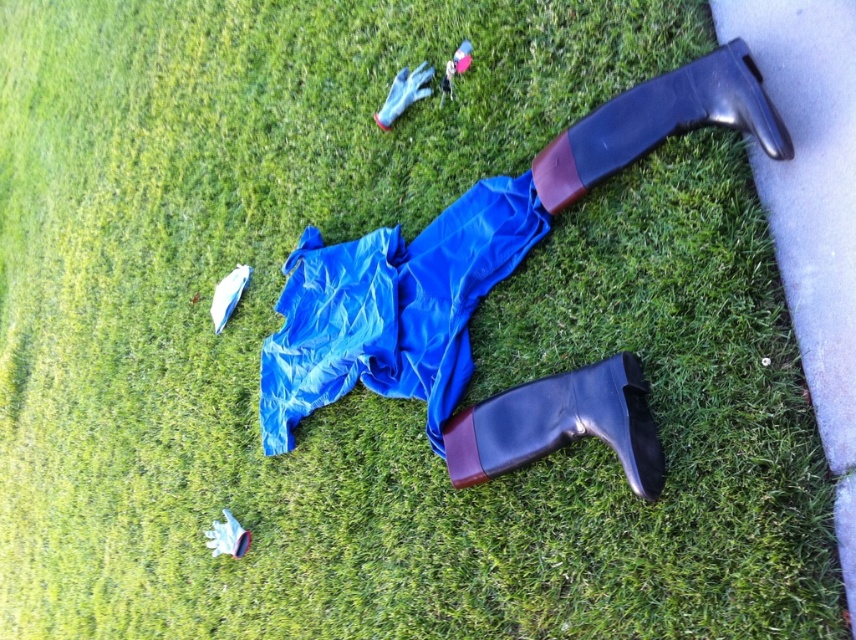
Question: Which point is farther to the camera?

Choices:
 (A) (590, 131)
 (B) (391, 268)
 (C) (476, 445)

Answer: (B)

Question: Which of the following is the farthest from the observer?

Choices:
 (A) shiny black boot at lower center
 (B) blue tarp at center
 (C) rubber boot at upper right

Answer: (B)

Question: Estimate the real-world distances between objects in this image. Which object is farther from the shiny black boot at lower center?

Choices:
 (A) blue tarp at center
 (B) rubber boot at upper right

Answer: (B)

Question: Can you confirm if shiny black boot at lower center is smaller than rubber boot at upper right?

Choices:
 (A) yes
 (B) no

Answer: (A)

Question: Does shiny black boot at lower center have a larger size compared to rubber boot at upper right?

Choices:
 (A) yes
 (B) no

Answer: (B)

Question: Considering the relative positions of blue tarp at center and rubber boot at upper right in the image provided, where is blue tarp at center located with respect to rubber boot at upper right?

Choices:
 (A) right
 (B) left

Answer: (B)